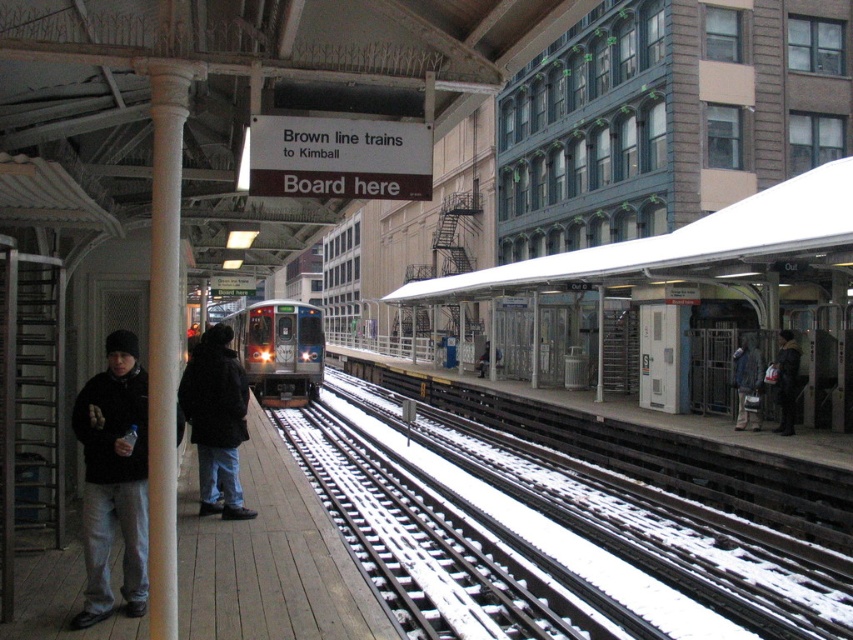
You are a passenger at the train station and want to board the Brown line train to Kimball. The sign says to board here. You see the wooden platform at left and the gray fabric jacket at right. Which object is closer to the boarding area indicated by the sign?

The wooden platform at left is closer to the boarding area because it is positioned to the left of the gray fabric jacket at right, and the sign directs passengers to board here where the wooden platform is located.

You are a passenger holding a large suitcase that is 1.5 meters long. You are standing at the dark brown leather jacket at right and want to place your suitcase under the white matte canopy at upper center. Can you fit your suitcase horizontally under the canopy without it extending beyond the canopy? Please consider the distance between the two objects.

The white matte canopy at upper center is 5.47 meters away from the dark brown leather jacket at right. Since the suitcase is 1.5 meters long, placing it horizontally between them would leave ample space, so yes, it can fit without extending beyond the canopy.